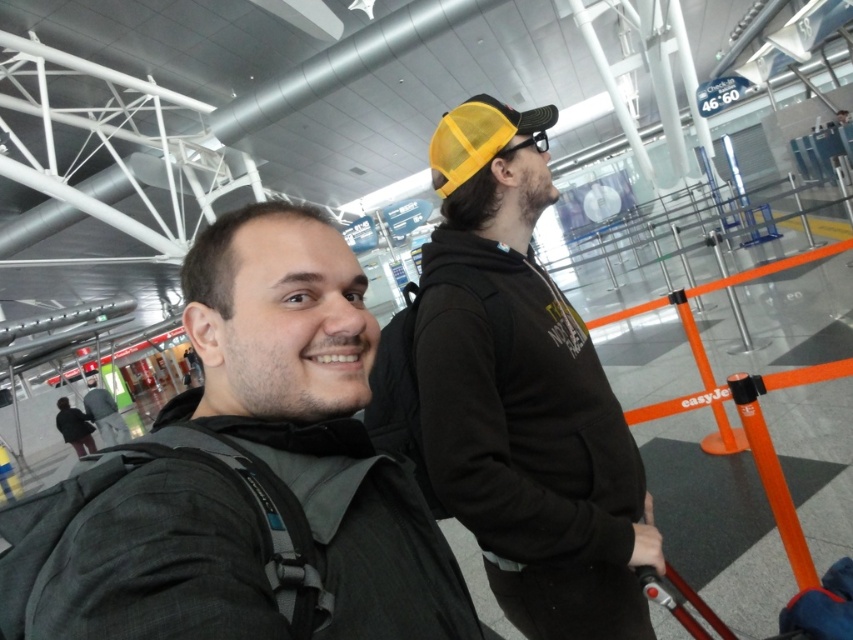
Consider the image. You are a security guard in the airport terminal. You need to locate the dark gray backpack at center. Where is the point with coordinates point (315, 417) located?

The point (315, 417) is located on the dark gray backpack at center.

You are a traveler at the airport and see the matte black hoodie at center and the yellow mesh cap at upper center. Which of these two items is positioned higher in the image?

The yellow mesh cap at upper center is positioned higher in the image than the matte black hoodie at center.

You are an airport security officer checking the scene. You notice the dark gray backpack at center and the yellow mesh cap at upper center. Which object is nearer to your viewpoint?

The dark gray backpack at center is closer to the viewer than the yellow mesh cap at upper center.